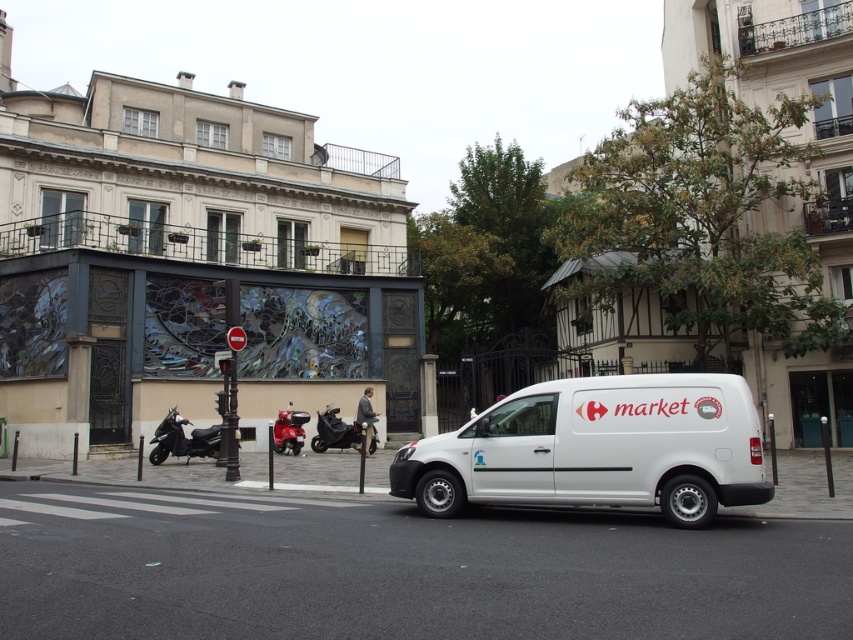
Question: Among these points, which one is farthest from the camera?

Choices:
 (A) (370, 436)
 (B) (291, 445)
 (C) (177, 429)

Answer: (B)

Question: Estimate the real-world distances between objects in this image. Which object is closer to the shiny black scooter at center?

Choices:
 (A) shiny black scooter at lower left
 (B) white matte van at center

Answer: (A)

Question: Which object is closer to the camera taking this photo?

Choices:
 (A) shiny black scooter at lower left
 (B) white matte van at center
 (C) shiny red motorcycle at center

Answer: (B)

Question: Can you confirm if shiny black scooter at center is smaller than shiny red motorcycle at center?

Choices:
 (A) no
 (B) yes

Answer: (A)

Question: Does shiny black scooter at lower left come behind shiny red motorcycle at center?

Choices:
 (A) no
 (B) yes

Answer: (A)

Question: Does shiny black scooter at center have a greater width compared to shiny red motorcycle at center?

Choices:
 (A) yes
 (B) no

Answer: (A)